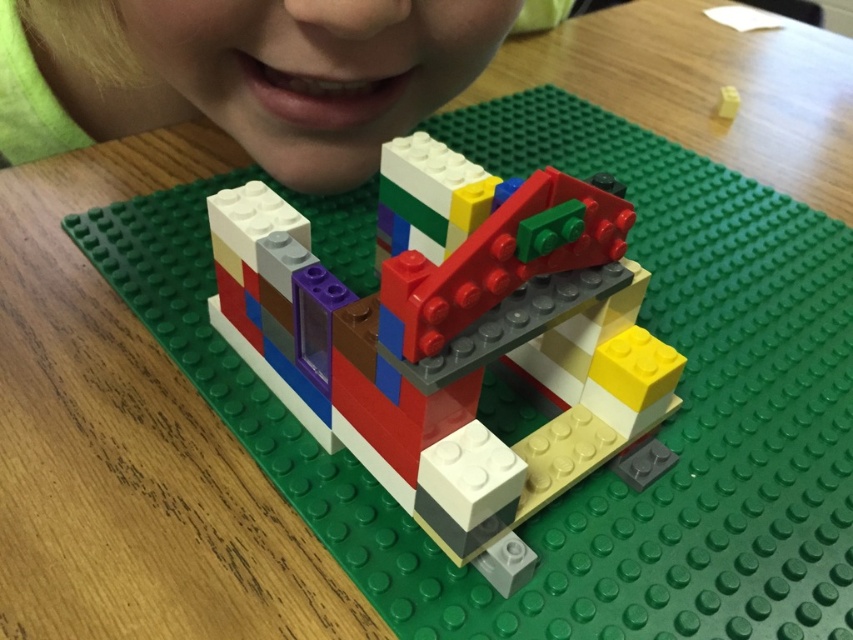
Looking at the LEGO structure, where is the multicolored plastic building block at center in relation to the matte green lego brick at upper center?

The multicolored plastic building block at center is to the right of the matte green lego brick at upper center.

You are a child trying to build a tower using the multicolored plastic building block at center and the matte green lego brick at upper center. Which brick should you choose if you want the base of the tower to be wider?

The matte green lego brick at upper center has a greater width than the multicolored plastic building block at center, so you should choose the matte green lego brick at upper center for a wider base.